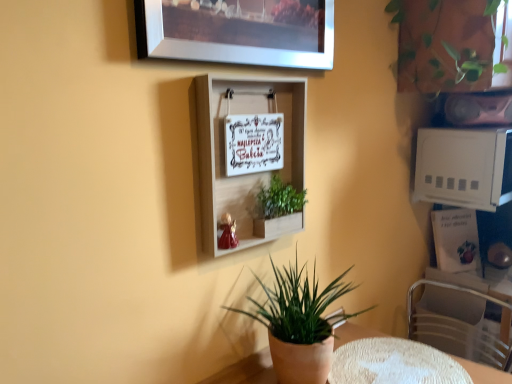
Question: Considering the positions of green matte plant at center, which is counted as the third houseplant, starting from the right, and green leafy plant at upper right, which is counted as the third houseplant, starting from the bottom, in the image, is green matte plant at center, which is counted as the third houseplant, starting from the right, taller or shorter than green leafy plant at upper right, which is counted as the third houseplant, starting from the bottom,?

Choices:
 (A) tall
 (B) short

Answer: (B)

Question: Is point (302, 213) closer or farther from the camera than point (421, 77)?

Choices:
 (A) closer
 (B) farther

Answer: (A)

Question: Estimate the real-world distances between objects in this image. Which object is farther from the white textured table at lower center?

Choices:
 (A) metallic silver swivel chair at lower right
 (B) green matte plant at center, which is counted as the third houseplant, starting from the right
 (C) white plastic microwave at upper right
 (D) green leafy plant at upper right, the first houseplant viewed from the top
 (E) green matte plant pot at lower center, which is the second houseplant from left to right

Answer: (D)

Question: Which is nearer to the white textured table at lower center?

Choices:
 (A) white plastic microwave at upper right
 (B) metallic silver swivel chair at lower right
 (C) white wooden shelf at center
 (D) green matte plant pot at lower center, which is the second houseplant from left to right
 (E) metallic silver picture frame at upper center

Answer: (B)